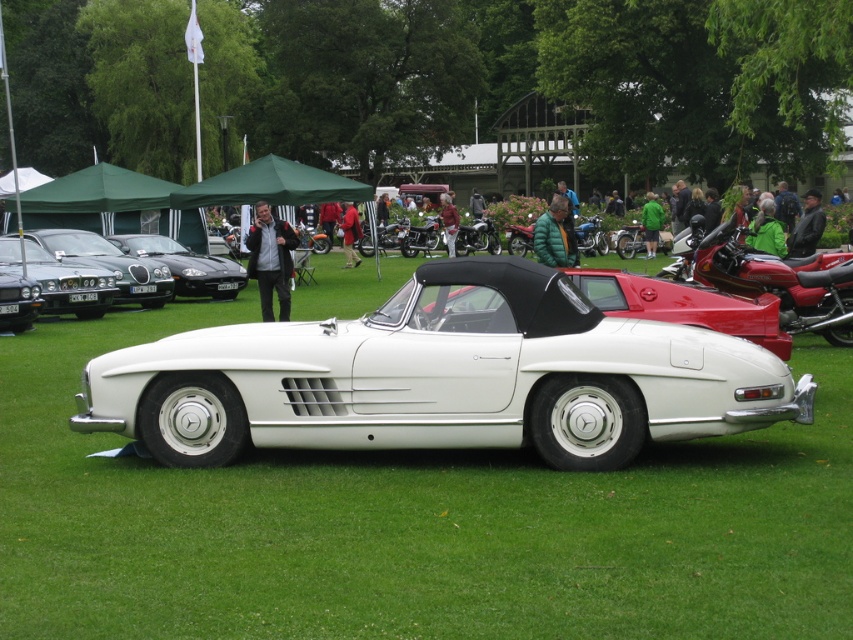
You are standing at the entrance of the car exhibition located at the bottom left corner of the field. You want to walk directly towards the white matte convertible at center. What direction should you head?

You should head northeast towards the white matte convertible at center since it is located at point (442, 378), which is northeast of the entrance at the bottom left corner.

You are standing at the entrance of the car exhibition and want to take a photo that includes both the point at coordinates point (457, 396) and point (187, 285). Since you want the closer point to be in focus, which point should you focus on?

Point (457, 396) is closer to the viewer than point (187, 285), so you should focus on point (457, 396) to ensure it is in focus.

You are standing in the middle of the grassy field at the classic car exhibition. You notice two points marked in the image. Which point, point (180, 406) or point (100, 300), is closer to you?

Point (180, 406) is closer to the viewer than point (100, 300).